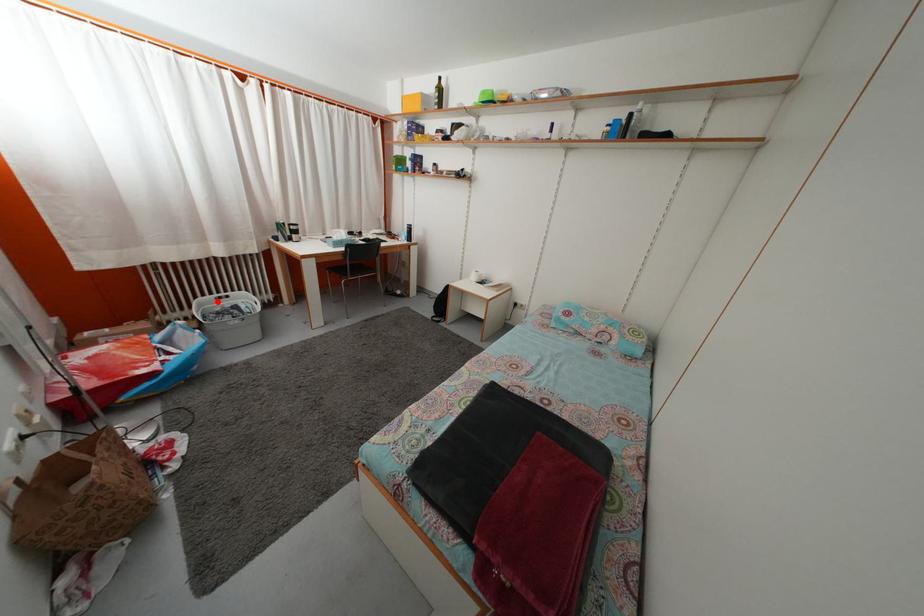
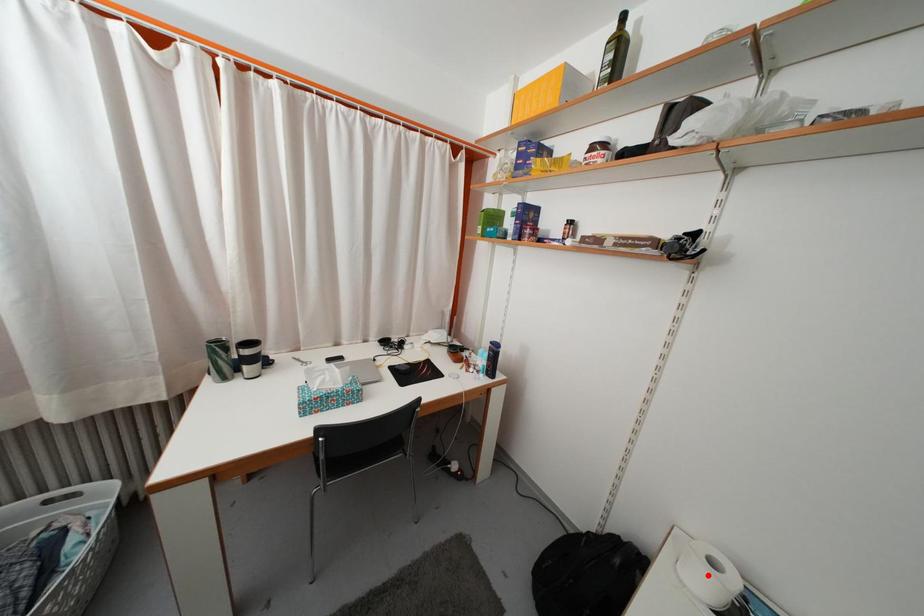
I am providing you with two images of the same scene from different viewpoints. A red point is marked on the first image and another point is marked on the second image. Is the red point in image1 aligned with the point shown in image2?

No